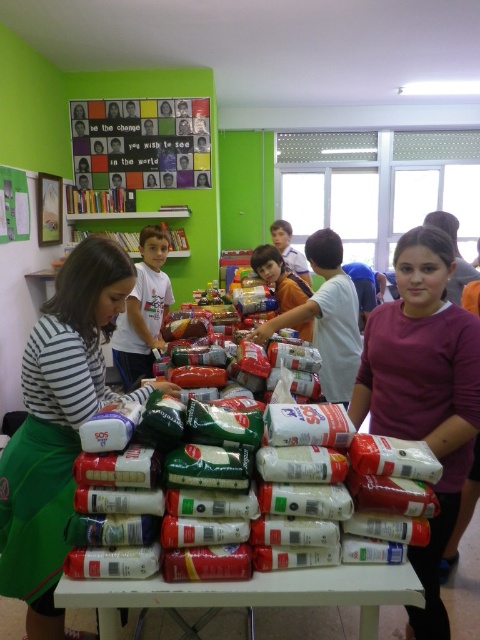
Is point (453, 451) farther from camera compared to point (302, 285)?

No, (453, 451) is closer to viewer.

Who is more distant from viewer, (405, 296) or (297, 289)?

Point (297, 289)

Is point (416, 308) in front of point (300, 330)?

Yes.

Locate an element on the screen. The image size is (480, 640). purple matte shirt at center is located at coordinates (423, 394).

Measure the distance between purple matte shirt at center and white matte rice at center.

purple matte shirt at center is 21.25 inches away from white matte rice at center.

Is point (432, 372) closer to viewer compared to point (217, 486)?

That is False.

Between point (462, 362) and point (330, 474), which one is positioned behind?

The point (462, 362) is more distant.

Locate an element on the screen. The height and width of the screenshot is (640, 480). purple matte shirt at center is located at coordinates (423, 394).

Looking at this image, who is positioned more to the right, striped fabric shirt at center or purple matte shirt at center?

Positioned to the right is purple matte shirt at center.

Is the position of striped fabric shirt at center less distant than that of purple matte shirt at center?

Yes, striped fabric shirt at center is closer to the viewer.

Who is more distant from viewer, (48, 412) or (431, 234)?

The point (431, 234) is behind.

Identify the location of striped fabric shirt at center. The width and height of the screenshot is (480, 640). (59, 424).